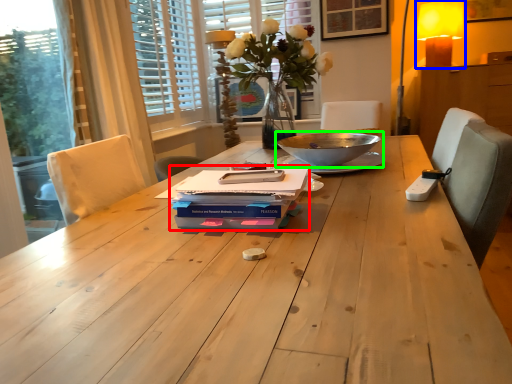
Question: Estimate the real-world distances between objects in this image. Which object is farther from paperback book (highlighted by a red box), table lamp (highlighted by a blue box) or bowl (highlighted by a green box)?

Choices:
 (A) table lamp
 (B) bowl

Answer: (A)